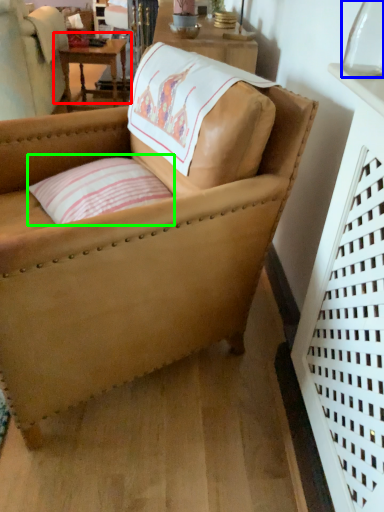
Question: Estimate the real-world distances between objects in this image. Which object is closer to table (highlighted by a red box), glass vase (highlighted by a blue box) or pillow (highlighted by a green box)?

Choices:
 (A) glass vase
 (B) pillow

Answer: (B)